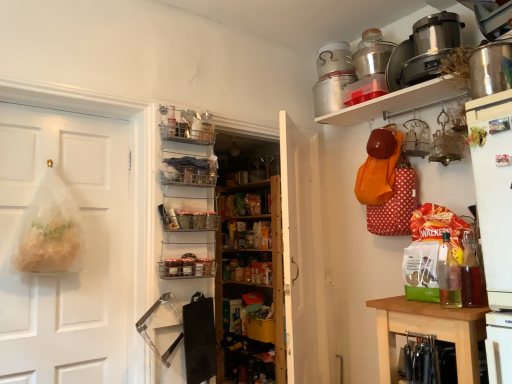
Question: In the image, is metallic silver pot at upper right, the 3th appliance from the top, on the left side or the right side of metallic wire baskets at center, the 2th shelf ordered from the bottom?

Choices:
 (A) left
 (B) right

Answer: (B)

Question: From a real-world perspective, is metallic silver pot at upper right, the 3th appliance from the top, physically located above or below metallic wire baskets at center, which is counted as the first shelf, starting from the top?

Choices:
 (A) below
 (B) above

Answer: (B)

Question: Which object is the farthest from the metallic wire baskets at center, the 2th shelf ordered from the bottom?

Choices:
 (A) shiny metallic pot at upper right, arranged as the 4th appliance when viewed from the back
 (B) green matte vegetable at upper right
 (C) white matte refrigerator at right, the first appliance positioned from the front
 (D) wooden knife block at lower right
 (E) metallic silver pot at upper right, the 3th appliance from the top

Answer: (A)

Question: Which object is positioned closest to the wooden bookshelf at center?

Choices:
 (A) wooden knife block at lower right
 (B) metallic wire basket at center, which is the second shelf from top to bottom
 (C) green matte vegetable at upper right
 (D) shiny metallic pot at upper right, the 4th appliance positioned from the top
 (E) white wood door at center, the second door from the left

Answer: (E)